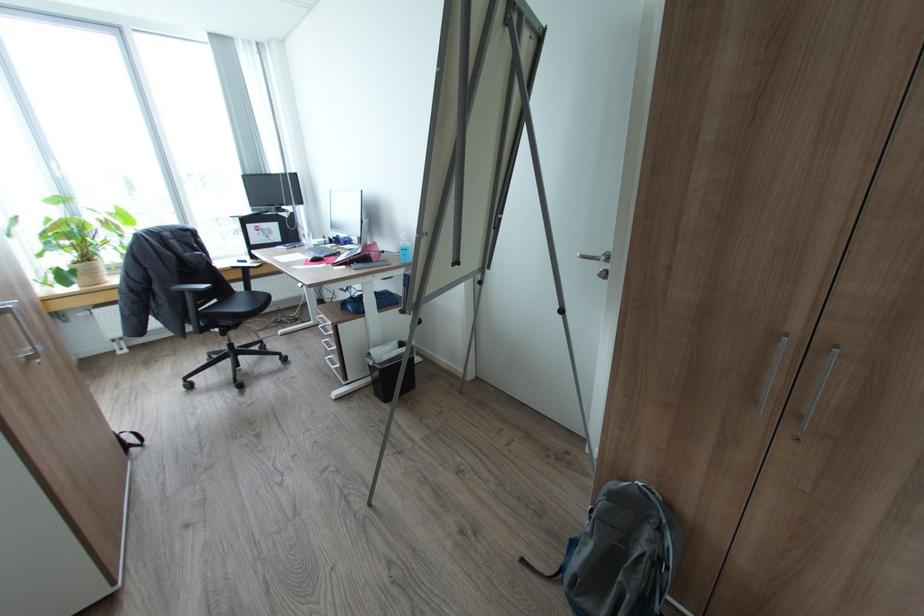
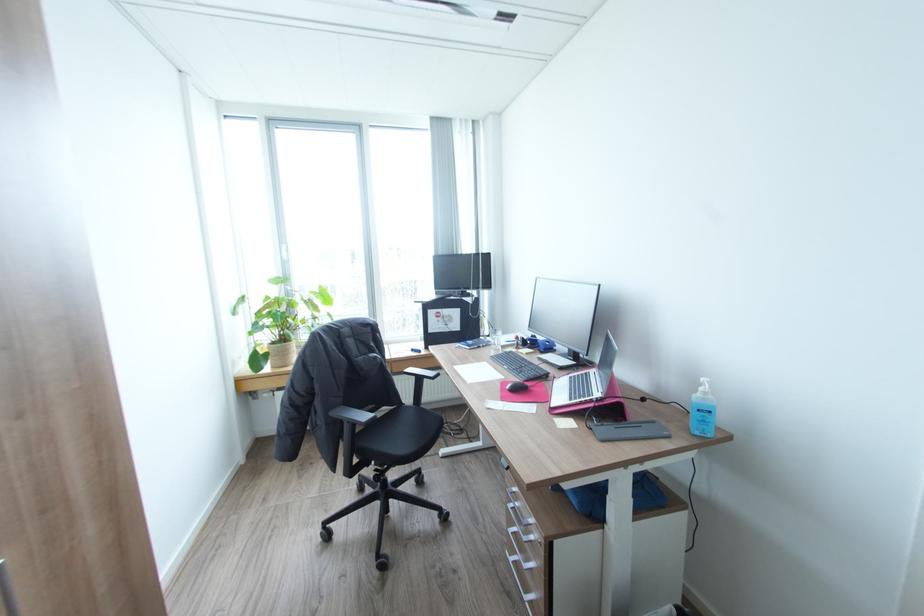
The point at [80,262] is marked in the first image. Where is the corresponding point in the second image?

(277, 342)